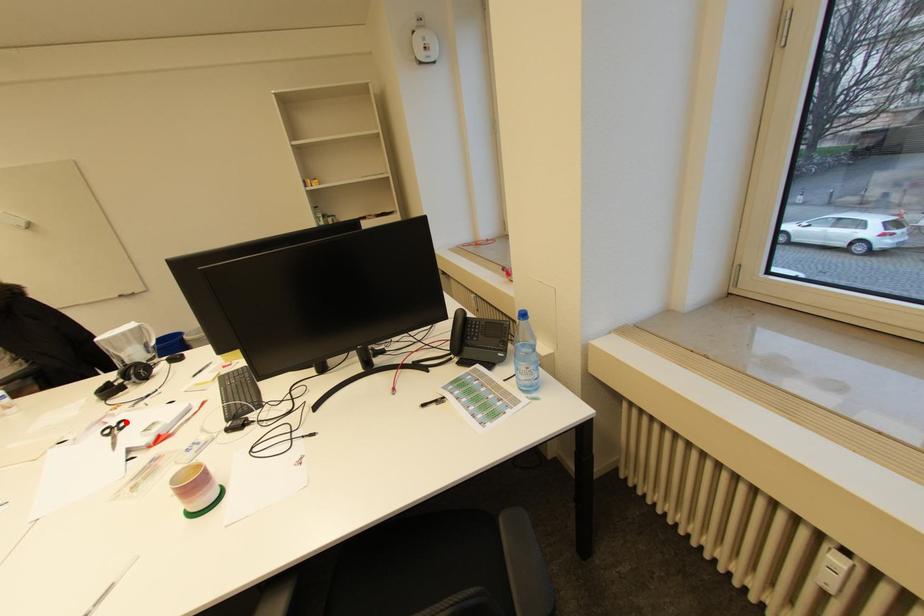
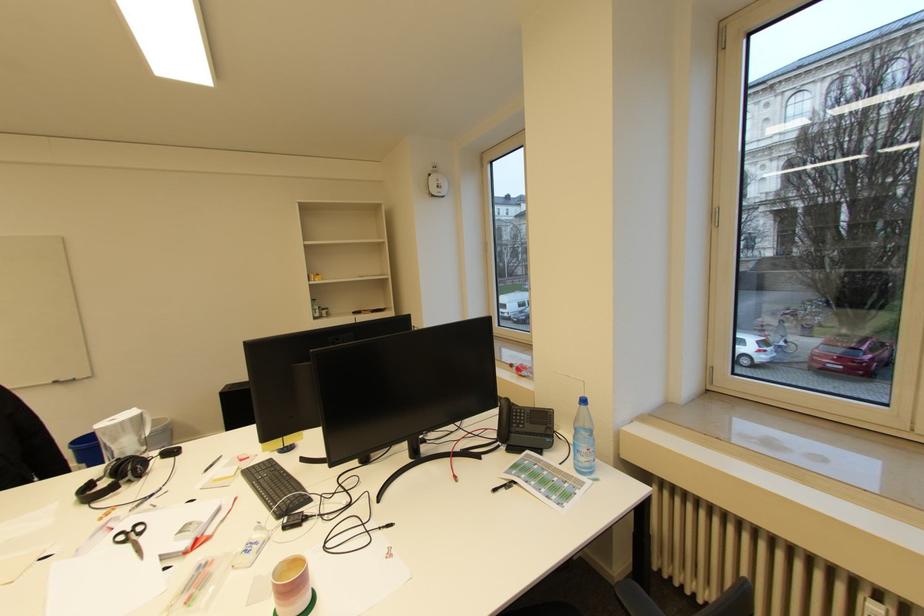
The point at the highlighted location is marked in the first image. Where is the corresponding point in the second image?

(141, 525)